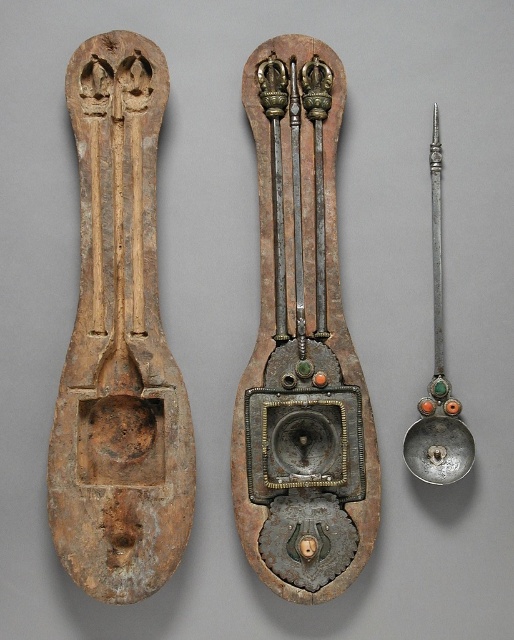
Can you confirm if brown wood spoon at center is wider than silver/golden metal spoon at right?

Yes.

Does point (48, 442) come closer to viewer compared to point (461, 449)?

That is True.

This screenshot has height=640, width=514. Find the location of `brown wood spoon at center`. brown wood spoon at center is located at coordinates [119, 342].

Does brown wood spoon at center have a lesser width compared to polished metal spoon at center?

Correct, brown wood spoon at center's width is less than polished metal spoon at center's.

Does brown wood spoon at center have a lesser height compared to polished metal spoon at center?

Incorrect, brown wood spoon at center's height does not fall short of polished metal spoon at center's.

What do you see at coordinates (119, 342) in the screenshot? The height and width of the screenshot is (640, 514). I see `brown wood spoon at center` at bounding box center [119, 342].

Locate an element on the screen. The height and width of the screenshot is (640, 514). brown wood spoon at center is located at coordinates (119, 342).

Which is more to the left, polished metal spoon at center or silver/golden metal spoon at right?

polished metal spoon at center is more to the left.

Is polished metal spoon at center taller than silver/golden metal spoon at right?

Correct, polished metal spoon at center is much taller as silver/golden metal spoon at right.

Based on the photo, who is more distant from viewer, (281, 330) or (473, 445)?

The point (281, 330) is more distant.

At what (x,y) coordinates should I click in order to perform the action: click on polished metal spoon at center. Please return your answer as a coordinate pair (x, y). Looking at the image, I should click on (302, 346).